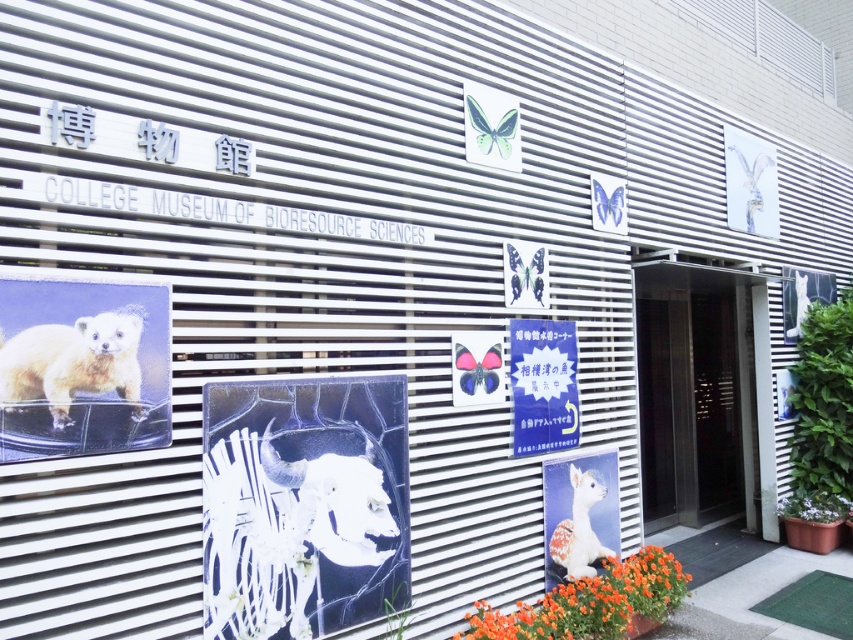
Does white glossy ram head at center have a smaller size compared to fuzzy yellow fur at left?

Actually, white glossy ram head at center might be larger than fuzzy yellow fur at left.

Is white glossy ram head at center positioned at the back of fuzzy yellow fur at left?

That is True.

What are the coordinates of `white glossy ram head at center` in the screenshot? It's located at (283, 531).

This screenshot has height=640, width=853. In order to click on blue paper sign at center in this screenshot , I will do `click(543, 385)`.

Can you confirm if blue paper sign at center is shorter than white woolen alpaca at lower center?

Incorrect, blue paper sign at center's height does not fall short of white woolen alpaca at lower center's.

Between point (553, 348) and point (564, 532), which one is positioned in front?

Point (564, 532) is in front.

Identify the location of blue paper sign at center. (543, 385).

Is metallic silver elevator at center smaller than orange matte flower at lower center?

Actually, metallic silver elevator at center might be larger than orange matte flower at lower center.

Is point (666, 376) less distant than point (599, 580)?

No, it is behind (599, 580).

Is point (762, 426) closer to viewer compared to point (550, 627)?

No, (762, 426) is further to viewer.

This screenshot has height=640, width=853. Identify the location of metallic silver elevator at center. (703, 392).